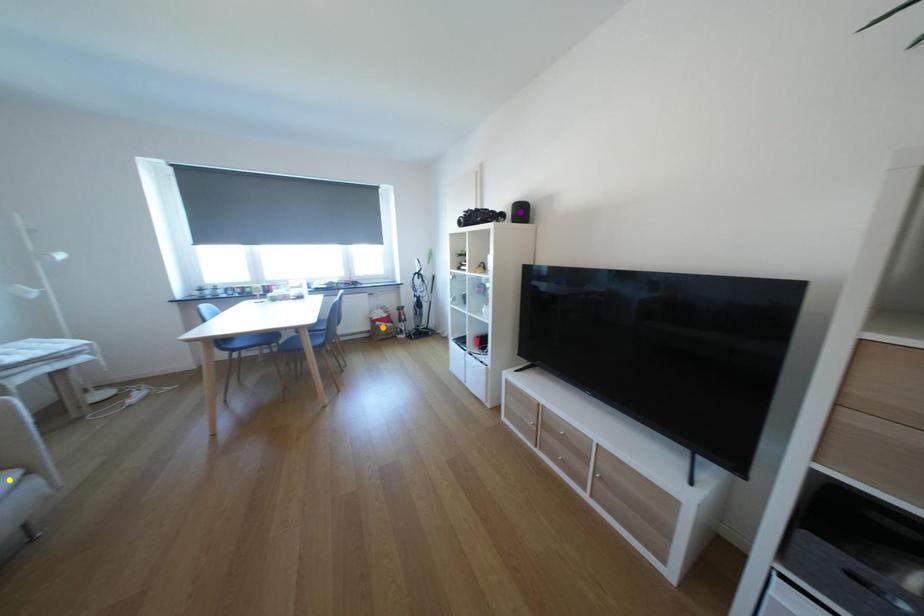
Order these from farthest to nearest:
purple point, orange point, yellow point

orange point < purple point < yellow point